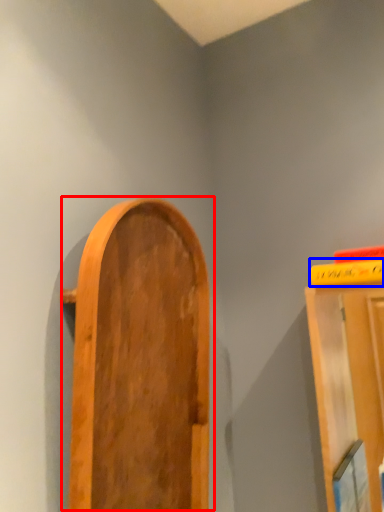
Question: Which object appears farthest to the camera in this image, door (highlighted by a red box) or book (highlighted by a blue box)?

Choices:
 (A) door
 (B) book

Answer: (B)